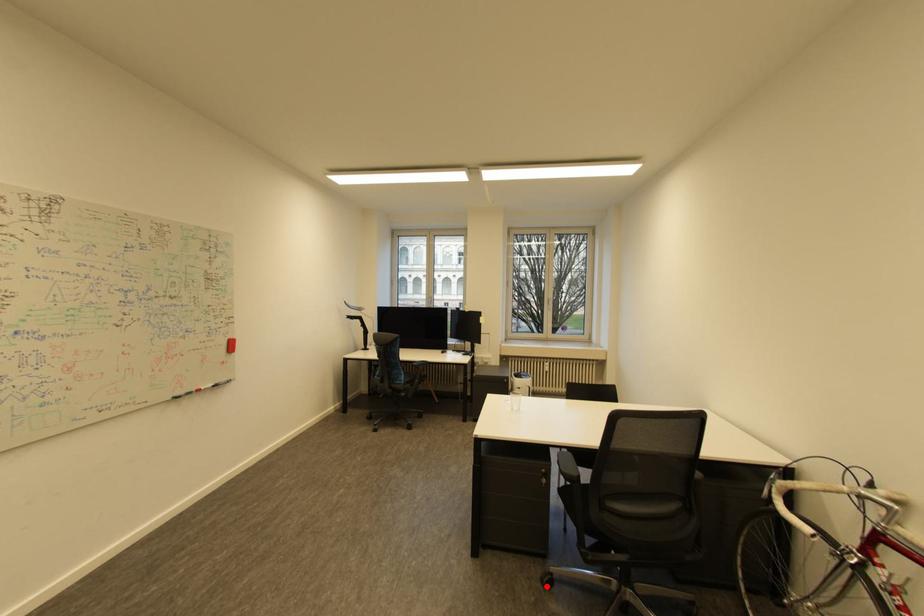
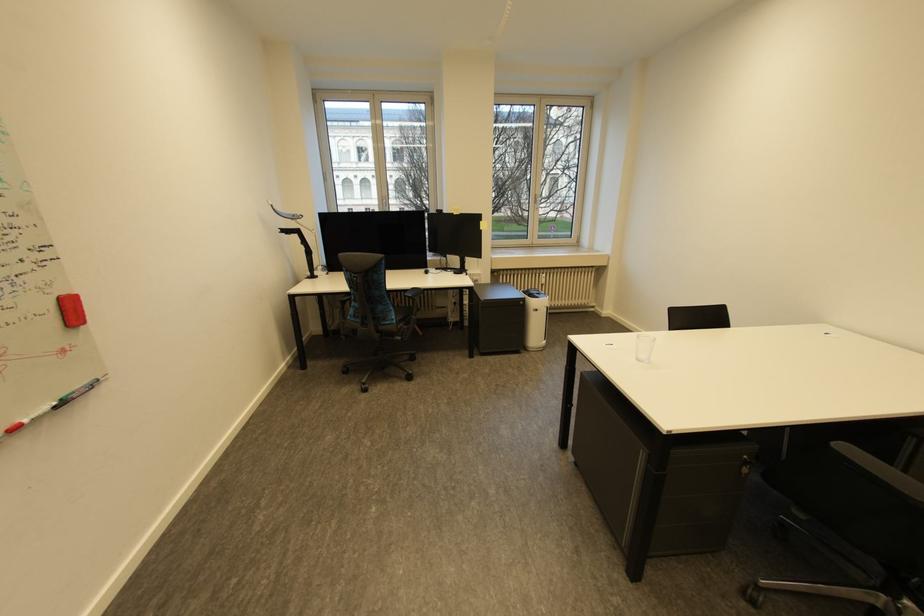
Find the pixel in the second image that matches the highlighted location in the first image.

(750, 604)